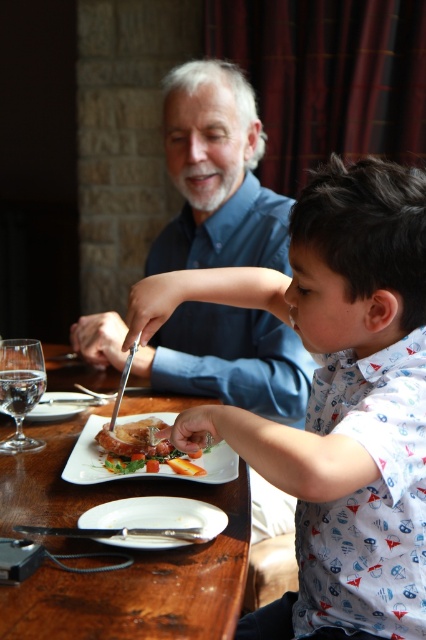
Is wooden table at center wider than white ceramic plate at center?

Indeed, wooden table at center has a greater width compared to white ceramic plate at center.

Which is in front, point (17, 452) or point (74, 412)?

Point (17, 452)

In order to click on wooden table at center in this screenshot , I will do [x=118, y=548].

Who is positioned more to the right, white cotton shirt at center or clear glass wine glass at left?

Positioned to the right is white cotton shirt at center.

Who is more forward, (x=316, y=477) or (x=5, y=440)?

Point (x=316, y=477)

The height and width of the screenshot is (640, 426). Identify the location of white cotton shirt at center. (336, 401).

Is golden brown crispy chicken at center closer to the viewer compared to white ceramic plate at center?

Yes, it is.

Can you confirm if golden brown crispy chicken at center is taller than white ceramic plate at center?

Yes, golden brown crispy chicken at center is taller than white ceramic plate at center.

Image resolution: width=426 pixels, height=640 pixels. In order to click on golden brown crispy chicken at center in this screenshot , I will do `click(141, 449)`.

Where is `golden brown crispy chicken at center`? golden brown crispy chicken at center is located at coordinates [141, 449].